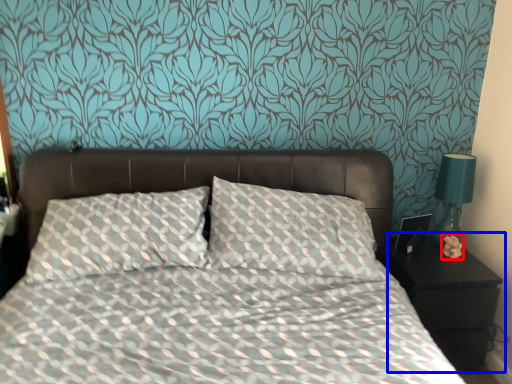
Question: Which point is further to the camera, flower (highlighted by a red box) or nightstand (highlighted by a blue box)?

Choices:
 (A) flower
 (B) nightstand

Answer: (A)